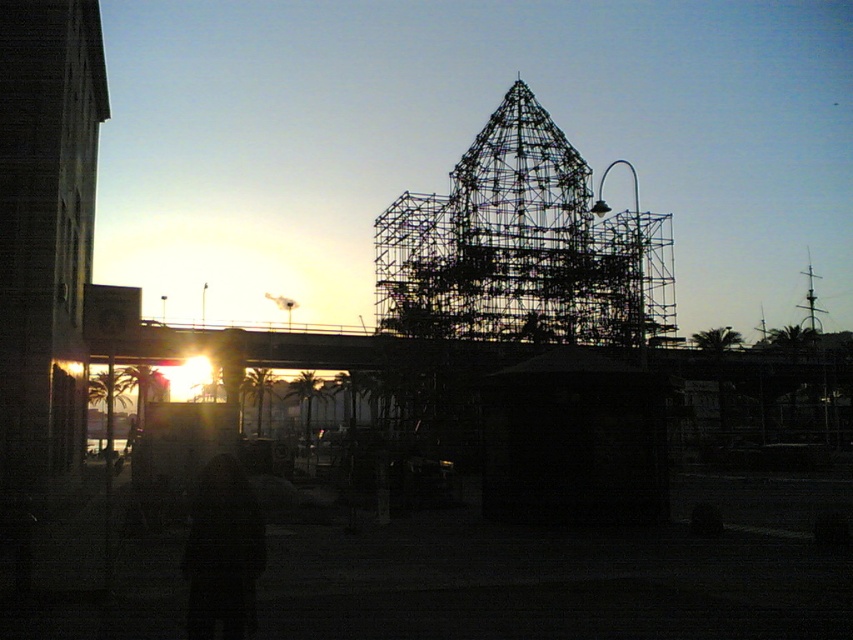
Is metallic scaffolding at center shorter than dark fabric coat at lower center?

In fact, metallic scaffolding at center may be taller than dark fabric coat at lower center.

Can you confirm if metallic scaffolding at center is bigger than dark fabric coat at lower center?

Yes.

At what (x,y) coordinates should I click in order to perform the action: click on metallic scaffolding at center. Please return your answer as a coordinate pair (x, y). The height and width of the screenshot is (640, 853). Looking at the image, I should click on [x=523, y=248].